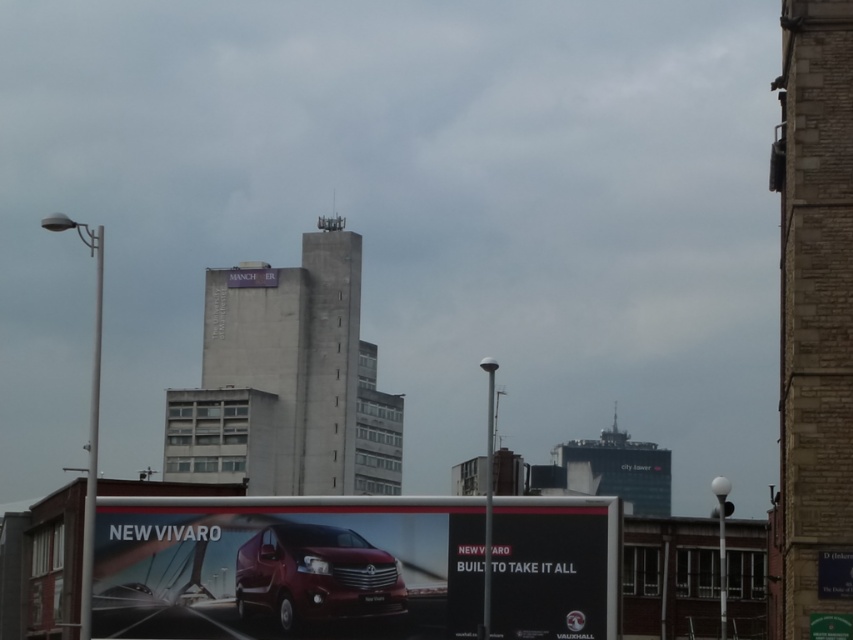
What is the 2D coordinate of the brick textured building at right in the image?

The brick textured building at right is located at the 2D coordinate point of [815,316].

You are a delivery driver who needs to know if the black glossy sign at center is taller than the glossy metallic van at center in the image. Can you confirm this?

The black glossy sign at center has a greater height compared to the glossy metallic van at center, so yes, the black glossy sign at center is taller than the glossy metallic van at center.

You are a delivery driver who needs to park your 2.5 meter wide glossy metallic van at center. There is a black glossy sign at center that you must not hit. Can you safely park your van here without hitting the sign?

The black glossy sign at center is 8.85 meters away from the glossy metallic van at center. Since the distance between them is greater than the van width of 2.5 meters, the van can be parked safely without hitting the sign.